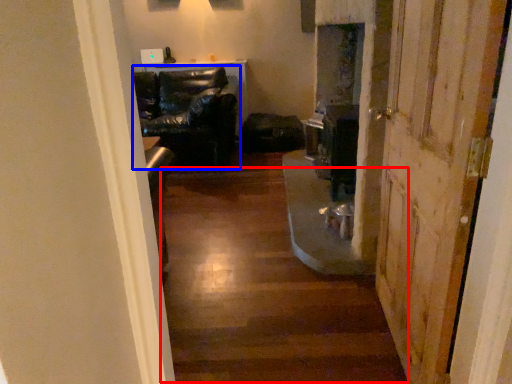
Question: Which point is closer to the camera, stairwell (highlighted by a red box) or chair (highlighted by a blue box)?

Choices:
 (A) stairwell
 (B) chair

Answer: (A)